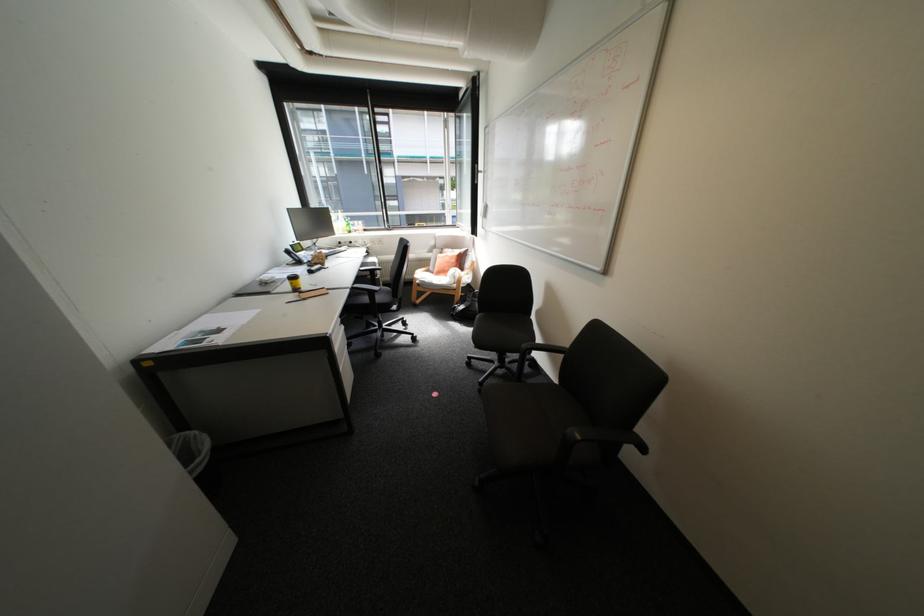
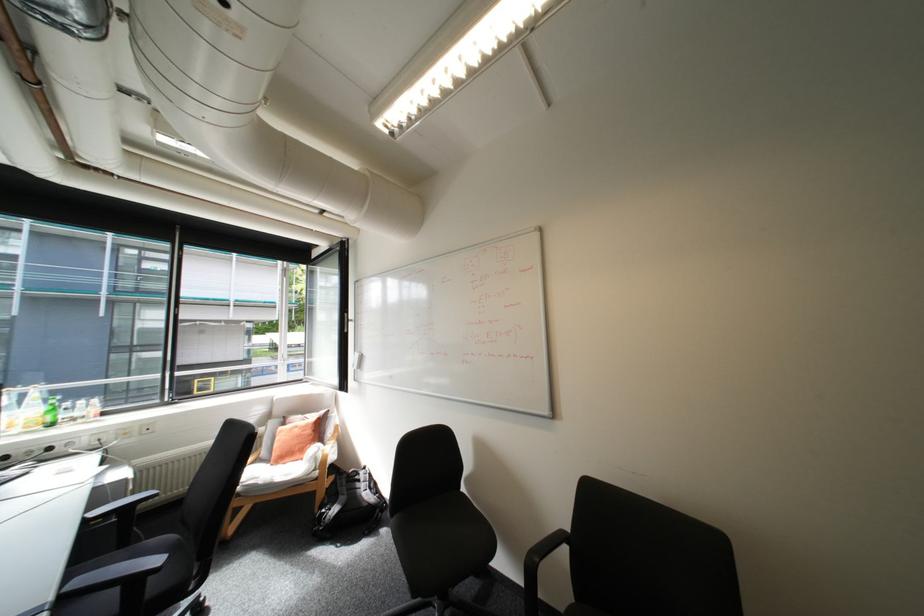
Find the pixel in the second image that matches the point at 456,257 in the first image.

(307, 429)